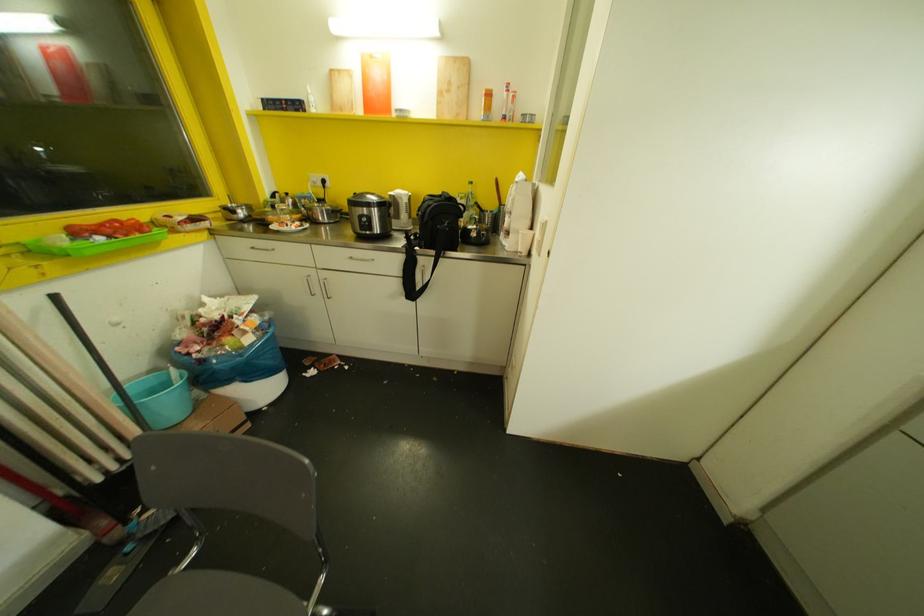
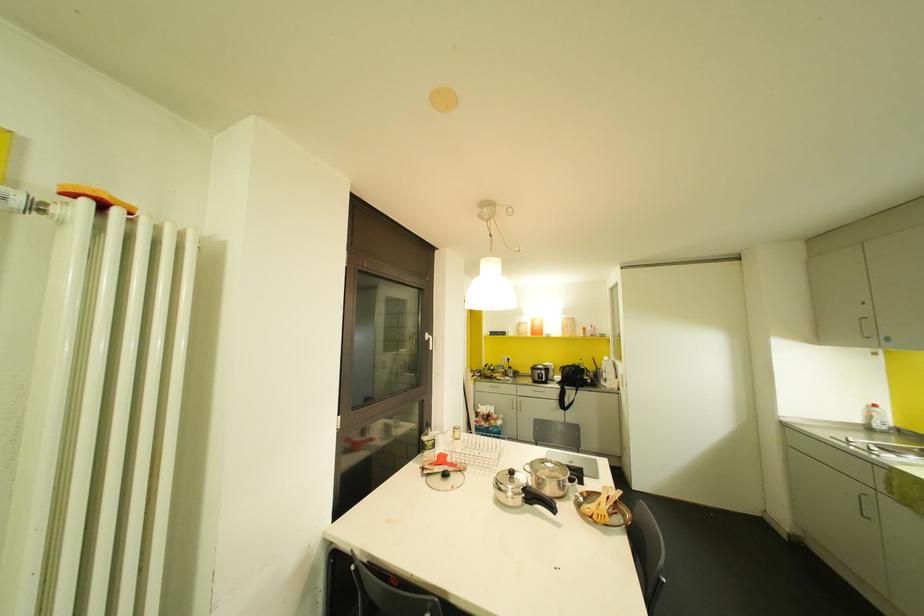
In the second image, find the point that corresponds to (377,102) in the first image.

(536, 331)